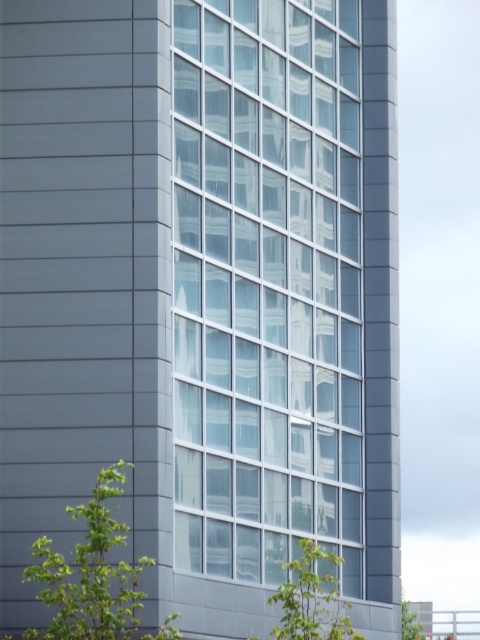
You are standing in front of the modern building and see a point at coordinates (94, 576). What object is located at that point?

The point at coordinates (94, 576) corresponds to the green leafy tree at lower left.